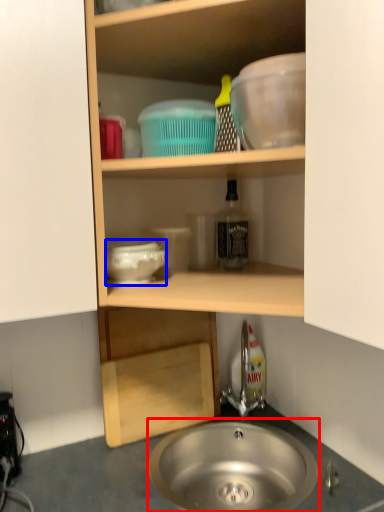
Question: Which of the following is the farthest to the observer, sink (highlighted by a red box) or basin (highlighted by a blue box)?

Choices:
 (A) sink
 (B) basin

Answer: (B)